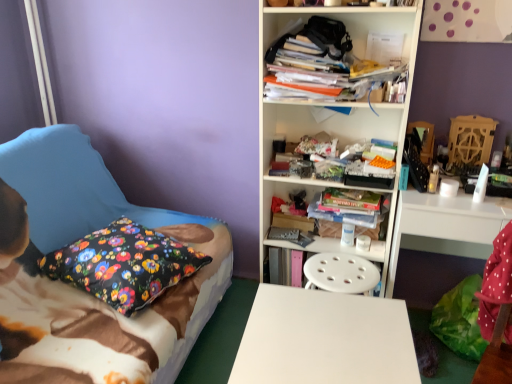
You are a GUI agent. You are given a task and a screenshot of the screen. Output one action in this format:
    pyautogui.click(x=<x>, y=<y>)
    Task: Click on the floral fabric pillow at left
    This screenshot has width=512, height=384.
    Given the screenshot: What is the action you would take?
    pyautogui.click(x=85, y=293)

This screenshot has width=512, height=384. I want to click on white plastic bookcase at center, so click(x=339, y=105).

Considering the positions of objects white plastic bookcase at center and floral fabric pillow at left in the image provided, who is more to the left, white plastic bookcase at center or floral fabric pillow at left?

Positioned to the left is floral fabric pillow at left.

Is white plastic bookcase at center oriented away from floral fabric pillow at left?

That's not correct — white plastic bookcase at center is not looking away from floral fabric pillow at left.

Is white plastic bookcase at center spatially inside floral fabric pillow at left, or outside of it?

white plastic bookcase at center is not enclosed by floral fabric pillow at left.

Are white plastic bookcase at center and floral fabric pillow at left beside each other?

They are not placed beside each other.

From a real-world perspective, is floral fabric pillow at left positioned above or below white glossy computer desk at right?

floral fabric pillow at left is above white glossy computer desk at right.

Considering the sizes of objects floral fabric pillow at left and white glossy computer desk at right in the image provided, who is smaller, floral fabric pillow at left or white glossy computer desk at right?

Smaller between the two is white glossy computer desk at right.

The width and height of the screenshot is (512, 384). I want to click on bed located above the white glossy computer desk at right (from the image's perspective), so click(85, 293).

Which object is wider, floral fabric pillow at left or white glossy computer desk at right?

floral fabric pillow at left is wider.

Could you tell me if white smooth desk at center is turned towards floral fabric pillow at left?

Yes.

Are white smooth desk at center and floral fabric pillow at left located far from each other?

No, white smooth desk at center is in close proximity to floral fabric pillow at left.

Does white smooth desk at center contain floral fabric pillow at left?

No, floral fabric pillow at left is located outside of white smooth desk at center.

The width and height of the screenshot is (512, 384). In order to click on bookcase that is on the left side of white glossy computer desk at right in this screenshot , I will do `click(339, 105)`.

Between white glossy computer desk at right and white plastic bookcase at center, which one appears on the right side from the viewer's perspective?

Positioned to the right is white glossy computer desk at right.

Is white glossy computer desk at right inside the boundaries of white plastic bookcase at center, or outside?

white glossy computer desk at right lies outside white plastic bookcase at center.

Can you tell me how much white glossy computer desk at right and white plastic bookcase at center differ in facing direction?

They differ by 0.000138 degrees in their facing directions.

Is floral fabric pillow at left positioned with its back to white plastic bookcase at center?

No.

Between floral fabric pillow at left and white plastic bookcase at center, which one has smaller width?

white plastic bookcase at center.

How different are the orientations of floral fabric pillow at left and white plastic bookcase at center in degrees?

The facing directions of floral fabric pillow at left and white plastic bookcase at center are 95 degrees apart.

Based on the photo, how distant is floral fabric pillow at left from white plastic bookcase at center?

floral fabric pillow at left is 32.42 inches from white plastic bookcase at center.

Is stacked books at center aimed at white smooth desk at center?

Yes, stacked books at center is aimed at white smooth desk at center.

Visually, is stacked books at center positioned to the left or to the right of white smooth desk at center?

In the image, stacked books at center appears on the right side of white smooth desk at center.

Who is shorter, stacked books at center or white smooth desk at center?

stacked books at center is shorter.

Considering the relative sizes of stacked books at center and white smooth desk at center in the image provided, is stacked books at center bigger than white smooth desk at center?

No.

How different are the orientations of floral fabric pillow at left and white smooth desk at center in degrees?

The facing directions of floral fabric pillow at left and white smooth desk at center are 159 degrees apart.

I want to click on pillow above the white smooth desk at center (from the image's perspective), so click(x=123, y=264).

Which object is thinner, floral fabric pillow at left or white smooth desk at center?

white smooth desk at center.

Which object is further away from the camera taking this photo, floral fabric pillow at left or white smooth desk at center?

floral fabric pillow at left is further from the camera.

You are a GUI agent. You are given a task and a screenshot of the screen. Output one action in this format:
    pyautogui.click(x=<x>, y=<y>)
    Task: Click on the bookcase lying behind the floral fabric pillow at left
    
    Given the screenshot: What is the action you would take?
    pyautogui.click(x=339, y=105)

Locate an element on the screen. computer desk below the floral fabric pillow at left (from a real-world perspective) is located at coordinates (443, 228).

Considering their positions, is white smooth desk at center positioned further to white glossy computer desk at right than floral fabric pillow at left?

floral fabric pillow at left is further to white glossy computer desk at right.

Based on the photo, which object lies nearer to the anchor point white plastic bookcase at center, white smooth desk at center or floral fabric pillow at left?

white smooth desk at center is closer to white plastic bookcase at center.

In the scene shown: When comparing their distances from white glossy computer desk at right, does floral fabric pillow at left or white smooth desk at center seem further?

floral fabric pillow at left is positioned further to the anchor white glossy computer desk at right.

From the image, which object appears to be nearer to white smooth desk at center, white glossy computer desk at right or white plastic bookcase at center?

white glossy computer desk at right is positioned closer to the anchor white smooth desk at center.

Estimate the real-world distances between objects in this image. Which object is further from white smooth desk at center, floral fabric pillow at left or stacked books at center?

Among the two, floral fabric pillow at left is located further to white smooth desk at center.

From the image, which object appears to be nearer to white glossy computer desk at right, floral fabric pillow at left or white plastic bookcase at center?

Based on the image, white plastic bookcase at center appears to be nearer to white glossy computer desk at right.

Considering their positions, is stacked books at center positioned further to white glossy computer desk at right than floral fabric pillow at left?

Based on the image, floral fabric pillow at left appears to be further to white glossy computer desk at right.

Looking at the image, which one is located closer to stacked books at center, white smooth desk at center or floral fabric pillow at left?

white smooth desk at center is closer to stacked books at center.

Image resolution: width=512 pixels, height=384 pixels. I want to click on pillow between floral fabric pillow at left and white smooth desk at center, so click(x=123, y=264).

You are a GUI agent. You are given a task and a screenshot of the screen. Output one action in this format:
    pyautogui.click(x=<x>, y=<y>)
    Task: Click on the cabinet between floral fabric pillow at left and white glossy computer desk at right from left to right
    The width and height of the screenshot is (512, 384).
    Given the screenshot: What is the action you would take?
    pyautogui.click(x=287, y=196)

Where is `cabinet between white plastic bookcase at center and white glossy computer desk at right from left to right`? The width and height of the screenshot is (512, 384). cabinet between white plastic bookcase at center and white glossy computer desk at right from left to right is located at coordinates (287, 196).

Where is `bookcase located between floral fabric pillow at left and white glossy computer desk at right in the left-right direction`? Image resolution: width=512 pixels, height=384 pixels. bookcase located between floral fabric pillow at left and white glossy computer desk at right in the left-right direction is located at coordinates (339, 105).